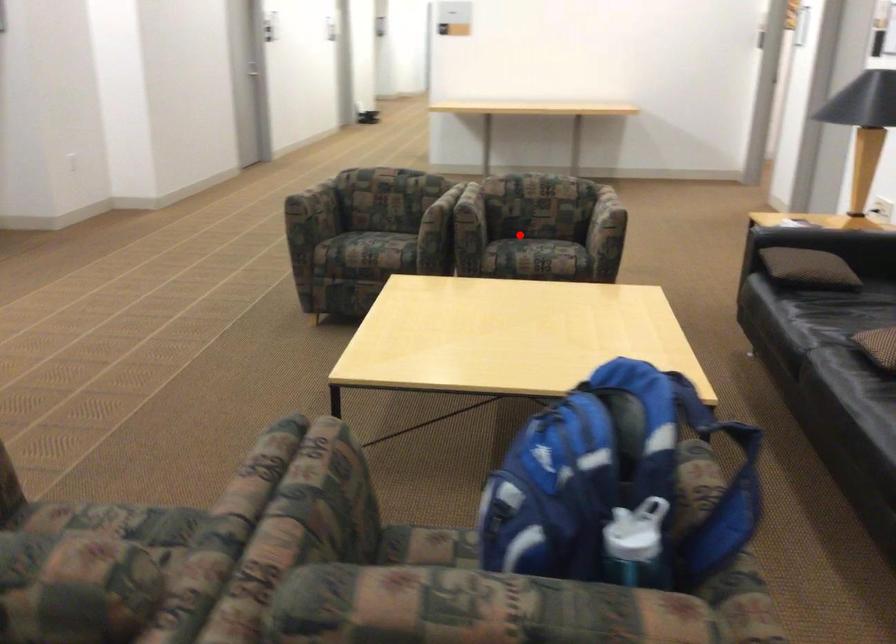
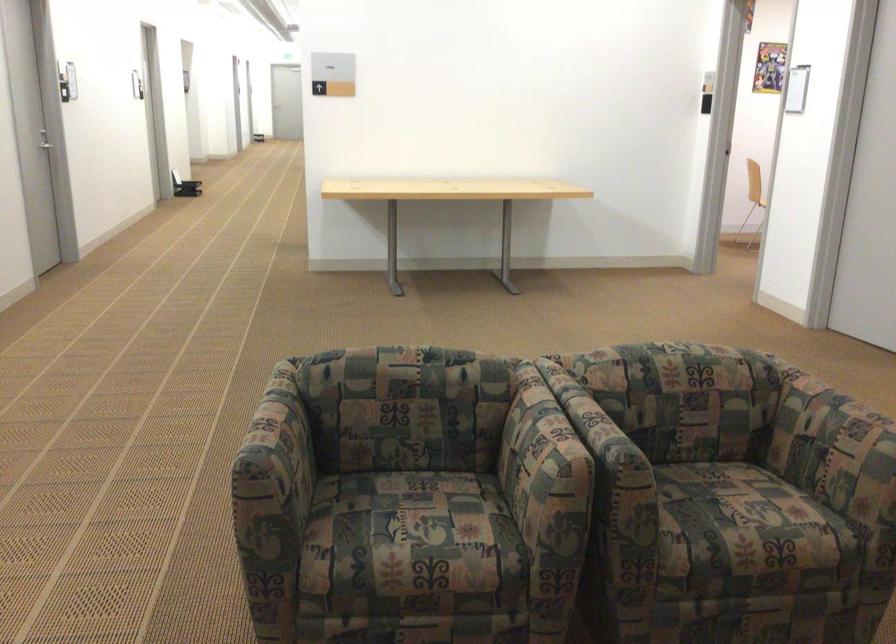
In the second image, find the point that corresponds to the highlighted location in the first image.

(707, 505)